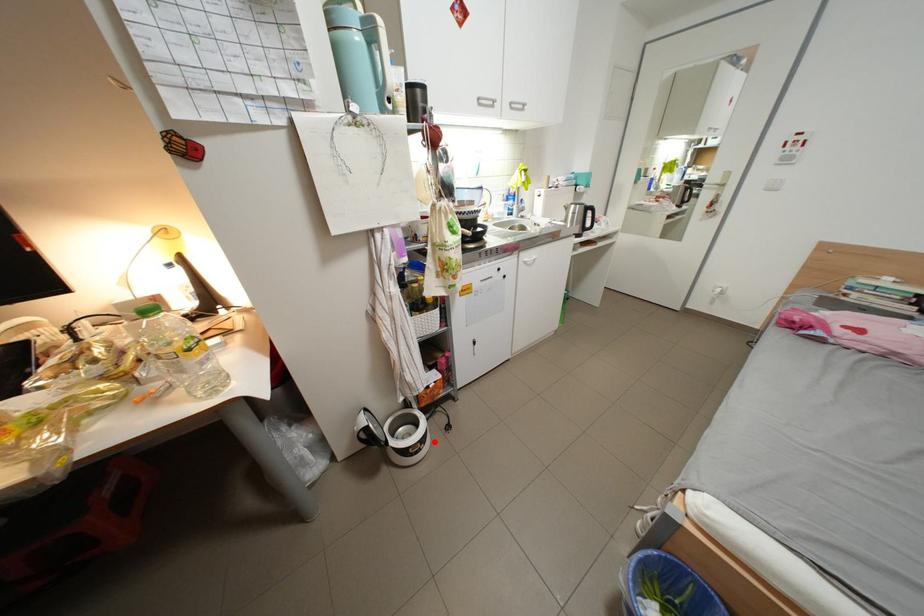
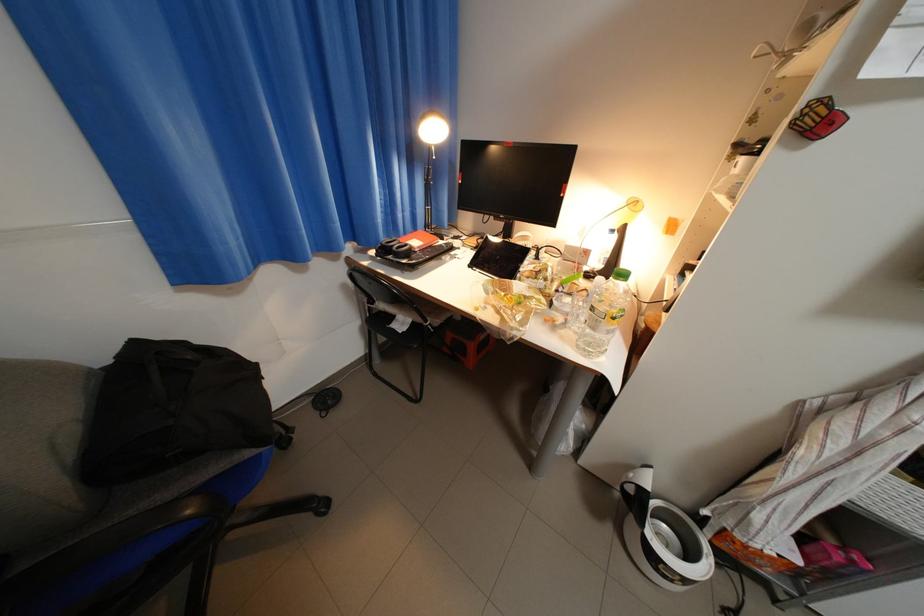
Question: I am providing you with two images of the same scene from different viewpoints. Given a red point in image1, look at the same physical point in image2. Is it:

Choices:
 (A) Closer to the viewpoint
 (B) Farther from the viewpoint

Answer: (A)